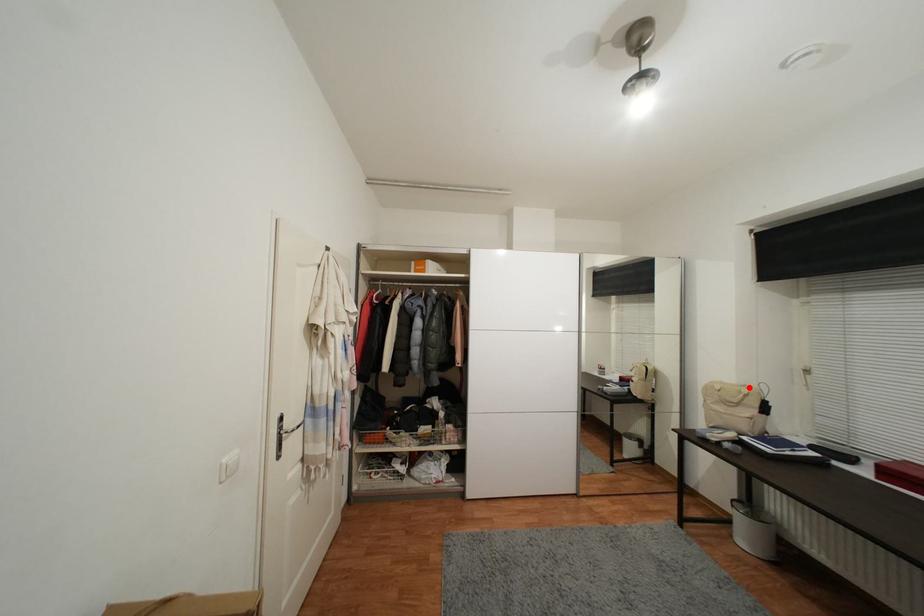
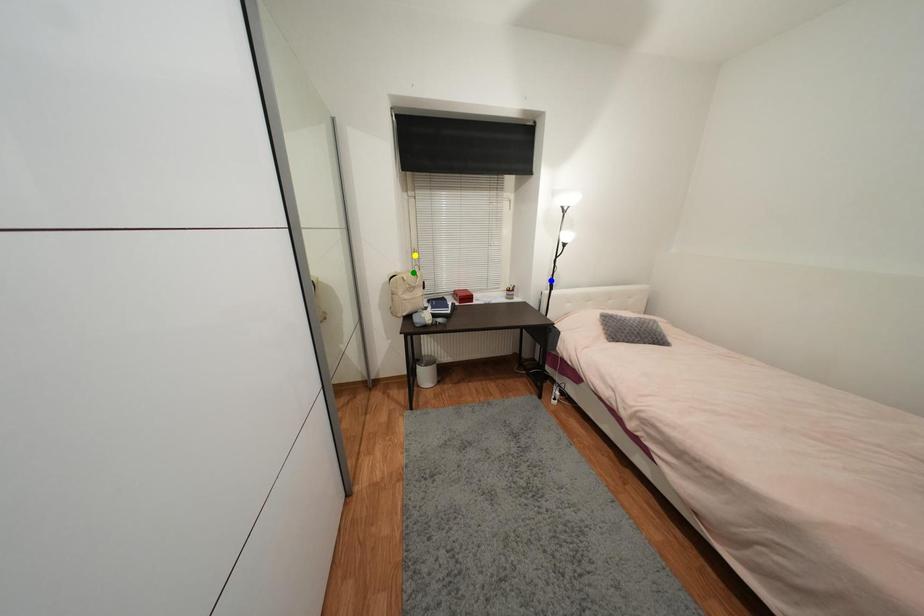
Question: I am providing you with two images of the same scene from different viewpoints. A red point is marked on the first image. You are given multiple points on the second image. Which point in image 2 represents the same 3d spot as the red point in image 1?

Choices:
 (A) green point
 (B) blue point
 (C) yellow point

Answer: (A)